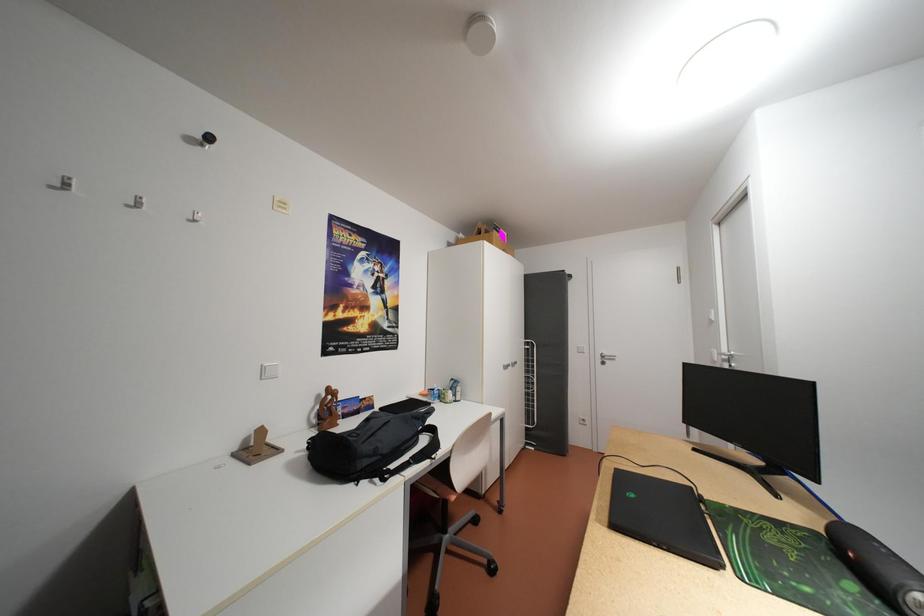
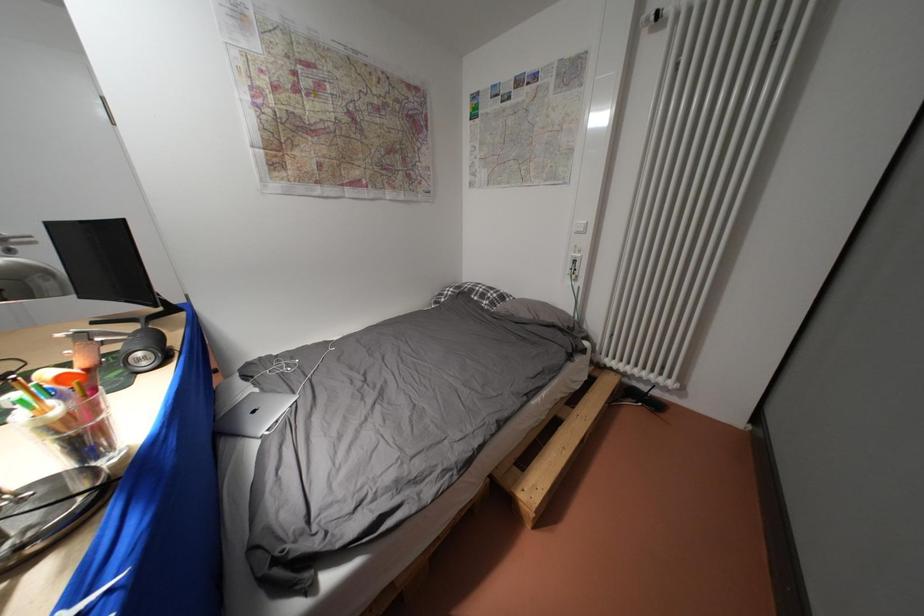
How did the camera likely rotate?

The camera's rotation is toward right-down.